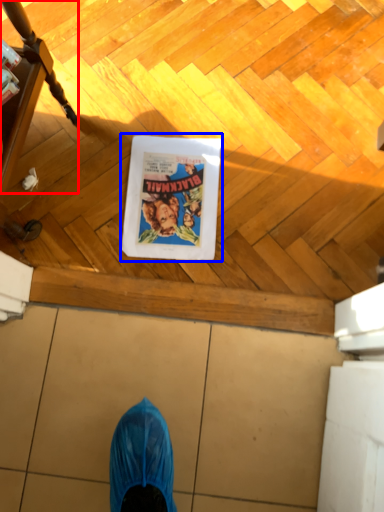
Question: Among these objects, which one is nearest to the camera, furniture (highlighted by a red box) or comic book character (highlighted by a blue box)?

Choices:
 (A) furniture
 (B) comic book character

Answer: (A)